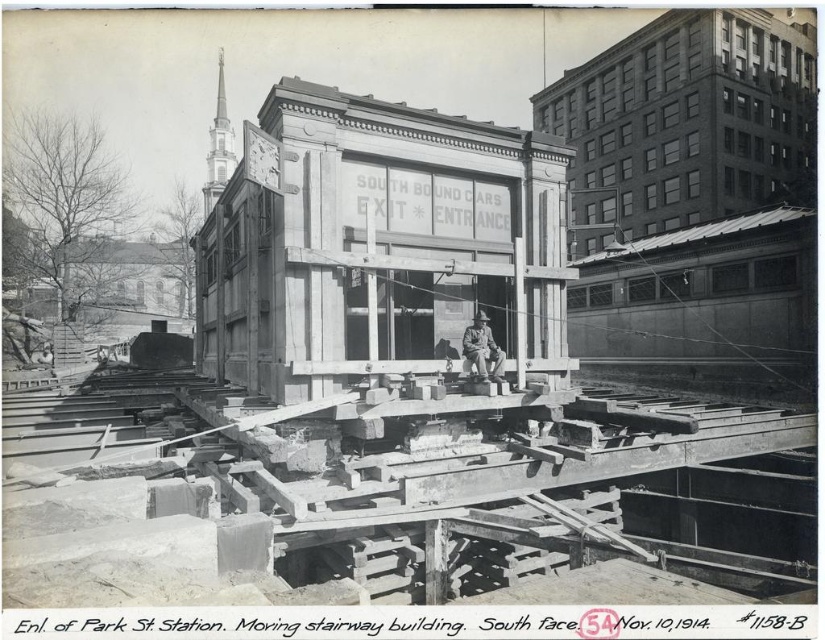
What do you see at coordinates (370, 483) in the screenshot?
I see `wooden beams at center` at bounding box center [370, 483].

Does wooden beams at center have a smaller size compared to camouflage fabric uniform at center?

Actually, wooden beams at center might be larger than camouflage fabric uniform at center.

Between point (656, 561) and point (483, 312), which one is positioned behind?

The point (483, 312) is more distant.

Identify the location of wooden beams at center. (370, 483).